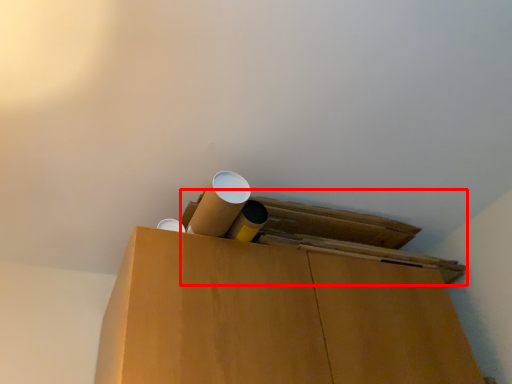
Question: From the image's perspective, where is wide (annotated by the red box) located relative to wide?

Choices:
 (A) above
 (B) below

Answer: (B)